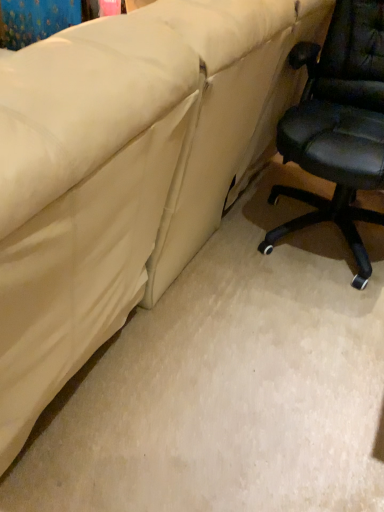
Image resolution: width=384 pixels, height=512 pixels. What do you see at coordinates (35, 20) in the screenshot? I see `white fabric curtain at upper left` at bounding box center [35, 20].

What is the approximate height of white fabric curtain at upper left?

It is 17.52 inches.

Locate an element on the screen. The width and height of the screenshot is (384, 512). white fabric curtain at upper left is located at coordinates (35, 20).

The image size is (384, 512). Find the location of `white fabric curtain at upper left`. white fabric curtain at upper left is located at coordinates (35, 20).